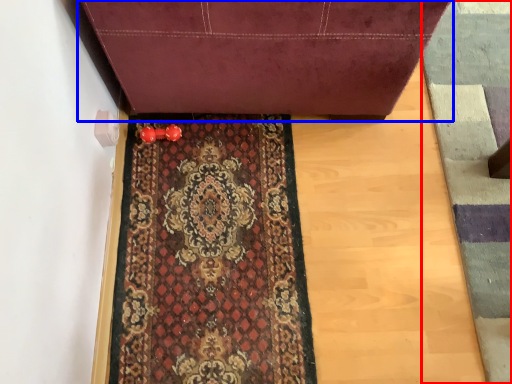
Question: Which point is further to the camera, doormat (highlighted by a red box) or furniture (highlighted by a blue box)?

Choices:
 (A) doormat
 (B) furniture

Answer: (A)